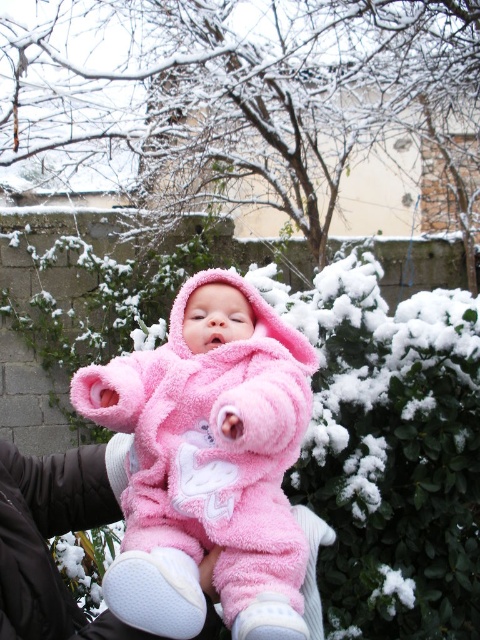
You are a photographer trying to capture the baby in the pink fluffy onesie at center without the white fluffy hedge at center blocking the view. Based on their heights, can you position yourself so that the hedge is entirely out of the frame?

The white fluffy hedge at center is taller than the pink fluffy onesie at center. Since the hedge is taller, positioning yourself lower might allow you to frame the baby below the hedge, but the hedge will still be partially visible. To completely exclude the hedge, you would need to move closer to the baby so that the hedge is out of the camera frame.

You are a photographer planning to take a picture of the baby in the fluffy pink snowsuit. The scene includes a white fluffy hedge at center. To ensure the hedge is in the background, where should you position the camera relative to the baby?

The white fluffy hedge at center is located at point (382, 428), so positioning the camera so that the baby is between the hedge and the camera will place the hedge in the background.